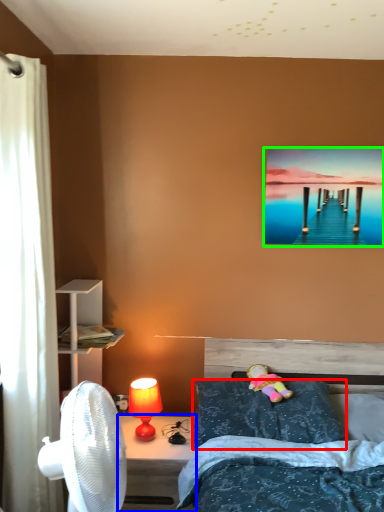
Question: Which is farther away from pillow (highlighted by a red box)? desk (highlighted by a blue box) or picture frame (highlighted by a green box)?

Choices:
 (A) desk
 (B) picture frame

Answer: (B)